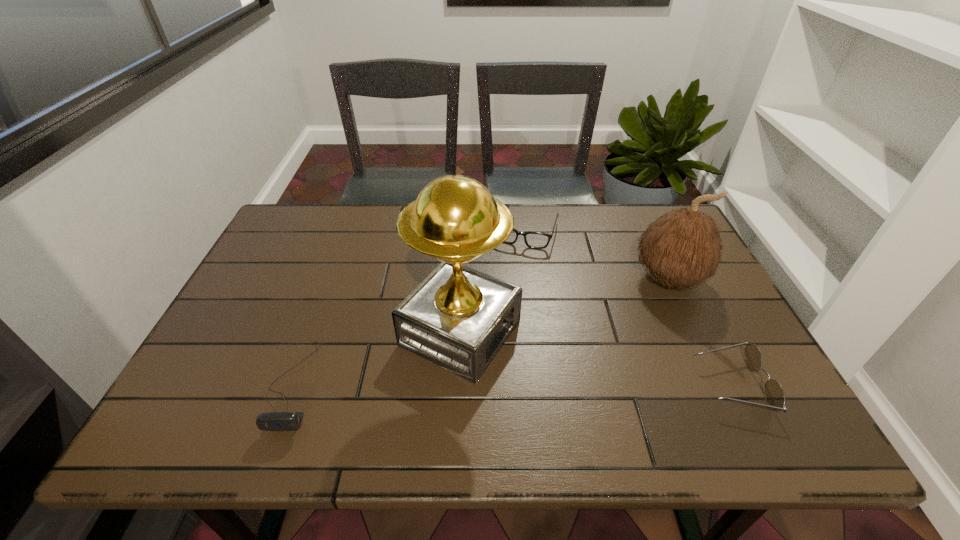
At what (x,y) coordinates should I click in order to perform the action: click on object that stands as the fourth closest to the left spectacles. Please return your answer as a coordinate pair (x, y). Image resolution: width=960 pixels, height=540 pixels. Looking at the image, I should click on (272, 421).